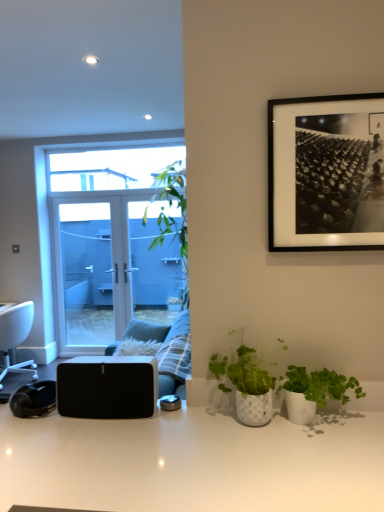
Question: Considering the relative sizes of white plastic chair at left and black matte speaker at lower left in the image provided, is white plastic chair at left bigger than black matte speaker at lower left?

Choices:
 (A) no
 (B) yes

Answer: (B)

Question: Is white plastic chair at left further to the viewer compared to black matte speaker at lower left?

Choices:
 (A) no
 (B) yes

Answer: (B)

Question: From the image's perspective, would you say white plastic chair at left is positioned over black matte speaker at lower left?

Choices:
 (A) yes
 (B) no

Answer: (B)

Question: Considering the relative sizes of white plastic chair at left and black matte speaker at lower left in the image provided, is white plastic chair at left wider than black matte speaker at lower left?

Choices:
 (A) yes
 (B) no

Answer: (A)

Question: Considering the relative sizes of white plastic chair at left and black matte speaker at lower left in the image provided, is white plastic chair at left taller than black matte speaker at lower left?

Choices:
 (A) no
 (B) yes

Answer: (B)

Question: From a real-world perspective, is white plastic chair at left positioned above or below black matte picture frame at upper right?

Choices:
 (A) below
 (B) above

Answer: (A)

Question: Considering the positions of white plastic chair at left and black matte picture frame at upper right in the image, is white plastic chair at left taller or shorter than black matte picture frame at upper right?

Choices:
 (A) short
 (B) tall

Answer: (B)

Question: Considering the positions of white plastic chair at left and black matte picture frame at upper right in the image, is white plastic chair at left bigger or smaller than black matte picture frame at upper right?

Choices:
 (A) big
 (B) small

Answer: (A)

Question: Looking at their shapes, would you say white plastic chair at left is wider or thinner than black matte picture frame at upper right?

Choices:
 (A) wide
 (B) thin

Answer: (A)

Question: From the image's perspective, relative to white glossy desk at center, is plush fabric couch at center above or below?

Choices:
 (A) below
 (B) above

Answer: (B)

Question: Visually, is plush fabric couch at center positioned to the left or to the right of white glossy desk at center?

Choices:
 (A) left
 (B) right

Answer: (A)

Question: Based on their sizes in the image, would you say plush fabric couch at center is bigger or smaller than white glossy desk at center?

Choices:
 (A) big
 (B) small

Answer: (B)

Question: Is plush fabric couch at center in front of or behind white glossy desk at center in the image?

Choices:
 (A) behind
 (B) front

Answer: (A)

Question: Does point (94, 412) appear closer or farther from the camera than point (228, 388)?

Choices:
 (A) farther
 (B) closer

Answer: (B)

Question: From the image's perspective, is black matte speaker at lower left located above or below green matte plant at center, the second houseplant when ordered from right to left?

Choices:
 (A) below
 (B) above

Answer: (A)